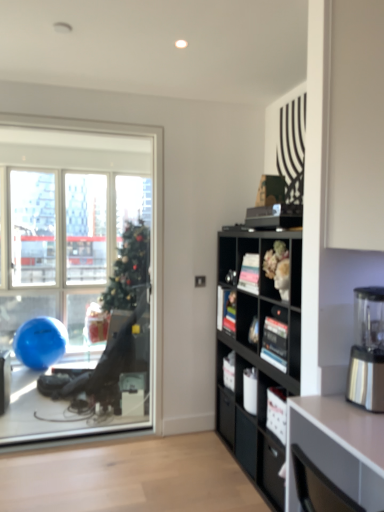
Question: Is black matte bookshelf at center-right positioned behind matte black bookshelf at center?

Choices:
 (A) yes
 (B) no

Answer: (B)

Question: Is there a large distance between black matte bookshelf at center-right and matte black bookshelf at center?

Choices:
 (A) yes
 (B) no

Answer: (B)

Question: Is black matte bookshelf at center-right facing towards matte black bookshelf at center?

Choices:
 (A) no
 (B) yes

Answer: (B)

Question: Can you confirm if black matte bookshelf at center-right is taller than matte black bookshelf at center?

Choices:
 (A) no
 (B) yes

Answer: (B)

Question: Does black matte bookshelf at center-right appear on the right side of matte black bookshelf at center?

Choices:
 (A) yes
 (B) no

Answer: (A)

Question: Does black matte bookshelf at center-right have a lesser height compared to matte black bookshelf at center?

Choices:
 (A) yes
 (B) no

Answer: (B)

Question: From the image's perspective, does stainless steel blender at right appear higher than matte black bookshelf at center?

Choices:
 (A) no
 (B) yes

Answer: (B)

Question: Is stainless steel blender at right in front of matte black bookshelf at center?

Choices:
 (A) no
 (B) yes

Answer: (B)

Question: Does stainless steel blender at right come behind matte black bookshelf at center?

Choices:
 (A) no
 (B) yes

Answer: (A)

Question: Considering the relative sizes of stainless steel blender at right and matte black bookshelf at center in the image provided, is stainless steel blender at right wider than matte black bookshelf at center?

Choices:
 (A) no
 (B) yes

Answer: (A)

Question: Does stainless steel blender at right have a smaller size compared to matte black bookshelf at center?

Choices:
 (A) yes
 (B) no

Answer: (A)

Question: Is stainless steel blender at right taller than matte black bookshelf at center?

Choices:
 (A) yes
 (B) no

Answer: (A)

Question: From the image's perspective, is matte black bookshelf at center on top of transparent glass window at left?

Choices:
 (A) yes
 (B) no

Answer: (B)